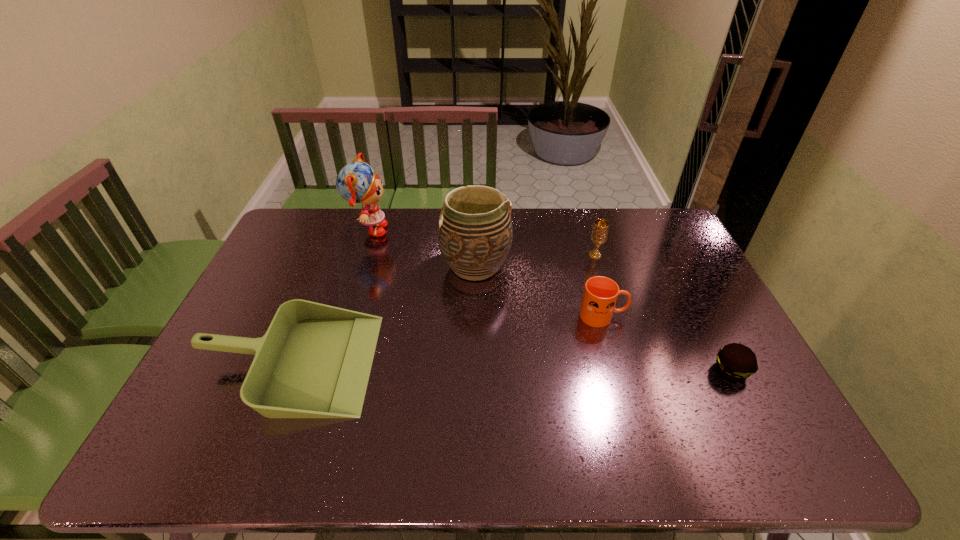
This screenshot has width=960, height=540. I want to click on doll, so click(x=356, y=182).

Where is `pottery`? pottery is located at coordinates (474, 231).

Locate an element on the screen. chalice is located at coordinates (599, 233).

The height and width of the screenshot is (540, 960). In order to click on mug in this screenshot , I will do `click(600, 295)`.

The image size is (960, 540). I want to click on dustpan, so click(x=314, y=361).

The image size is (960, 540). I want to click on the rightmost object, so click(x=735, y=361).

The width and height of the screenshot is (960, 540). I want to click on patty, so click(x=735, y=361).

The width and height of the screenshot is (960, 540). I want to click on free point located on the face of the doll, so click(433, 231).

You are a GUI agent. You are given a task and a screenshot of the screen. Output one action in this format:
    pyautogui.click(x=<x>, y=<y>)
    Task: Click on the vacant space located 0.120m on the left of the third object from left to right
    Image resolution: width=960 pixels, height=540 pixels.
    Given the screenshot: What is the action you would take?
    pyautogui.click(x=404, y=266)

I want to click on vacant space situated 0.120m on the front of the chalice, so click(x=604, y=285).